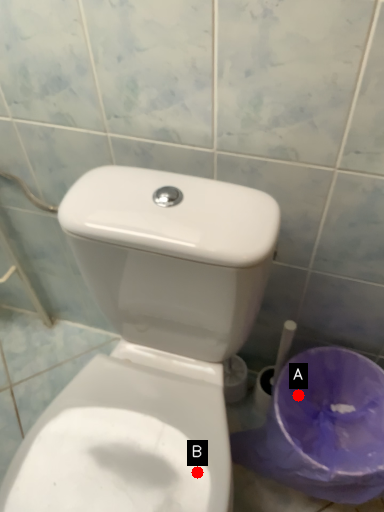
Question: Two points are circled on the image, labeled by A and B beside each circle. Which of the following is the farthest from the observer?

Choices:
 (A) A is further
 (B) B is further

Answer: (A)